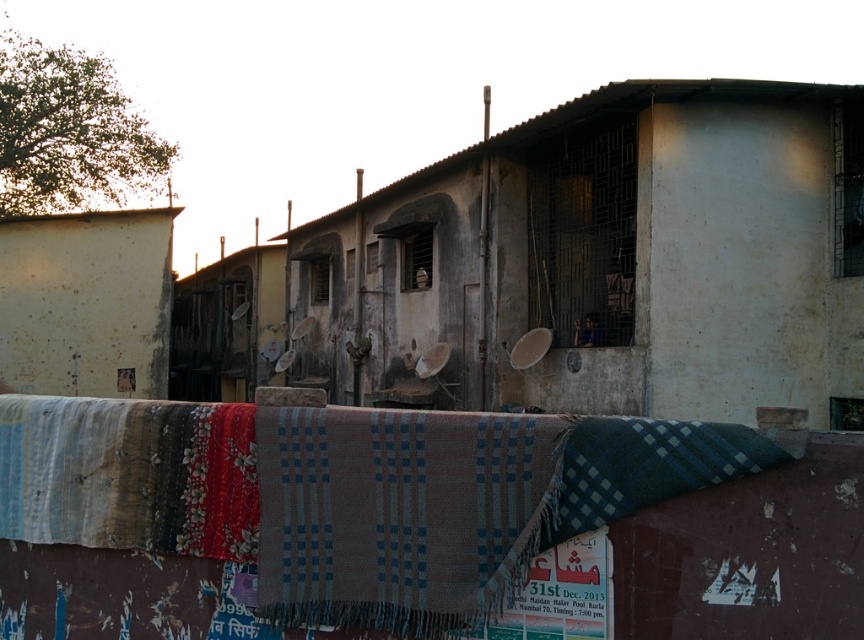
Question: Does weathered concrete building at center appear on the right side of yellowish concrete hut at center?

Choices:
 (A) yes
 (B) no

Answer: (A)

Question: Among these points, which one is farthest from the camera?

Choices:
 (A) (455, 250)
 (B) (240, 280)
 (C) (626, 508)
 (D) (81, 241)

Answer: (B)

Question: Which point is closer to the camera?

Choices:
 (A) (750, 104)
 (B) (499, 560)

Answer: (B)

Question: Estimate the real-world distances between objects in this image. Which object is closer to the yellowish concrete hut at center?

Choices:
 (A) plaid woolen blanket at center
 (B) white rough wall at left
 (C) weathered concrete building at center

Answer: (B)

Question: Does weathered concrete building at center appear on the right side of multicolored woven cloth at center?

Choices:
 (A) yes
 (B) no

Answer: (A)

Question: Is plaid woolen blanket at center smaller than yellowish concrete hut at center?

Choices:
 (A) yes
 (B) no

Answer: (A)